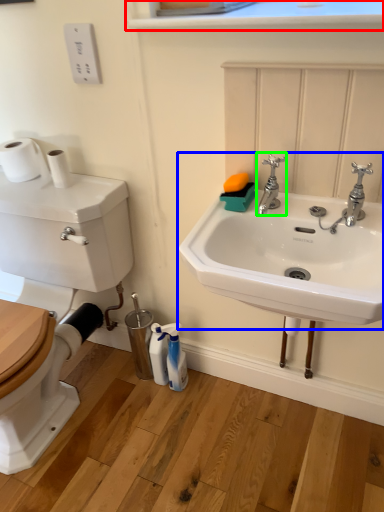
Question: Which object is the closest to the window sill (highlighted by a red box)? Choose among these: sink (highlighted by a blue box) or tap (highlighted by a green box).

Choices:
 (A) sink
 (B) tap

Answer: (B)